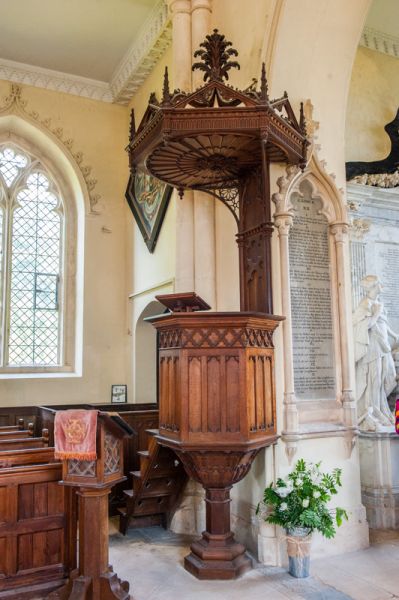
I want to click on window, so click(2, 226), click(41, 330), click(11, 161).